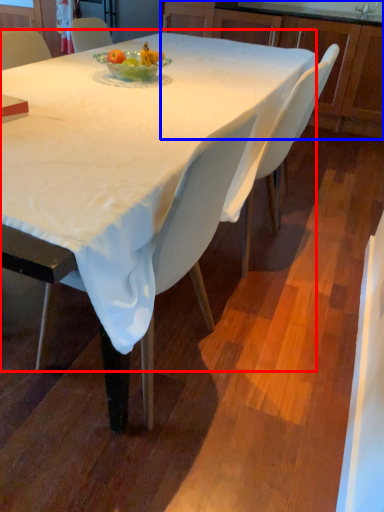
Question: Among these objects, which one is farthest to the camera, round table (highlighted by a red box) or cabinetry (highlighted by a blue box)?

Choices:
 (A) round table
 (B) cabinetry

Answer: (B)